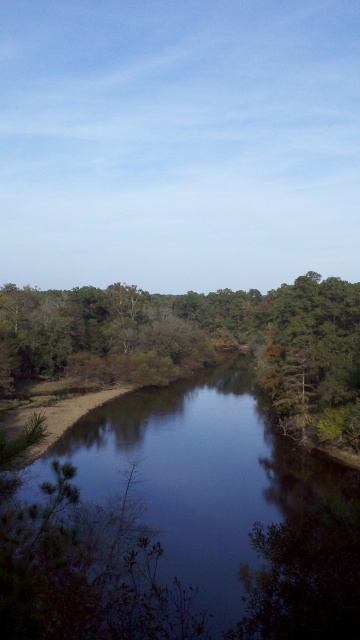
Question: Can you confirm if dark reflective water at center is smaller than green leafy tree at center?

Choices:
 (A) yes
 (B) no

Answer: (A)

Question: Which point is farther to the camera?

Choices:
 (A) green leafy tree at center
 (B) dark reflective water at center

Answer: (A)

Question: Is dark reflective water at center further to the viewer compared to green leafy tree at center?

Choices:
 (A) no
 (B) yes

Answer: (A)

Question: Can you confirm if dark reflective water at center is smaller than green leafy tree at center?

Choices:
 (A) yes
 (B) no

Answer: (A)